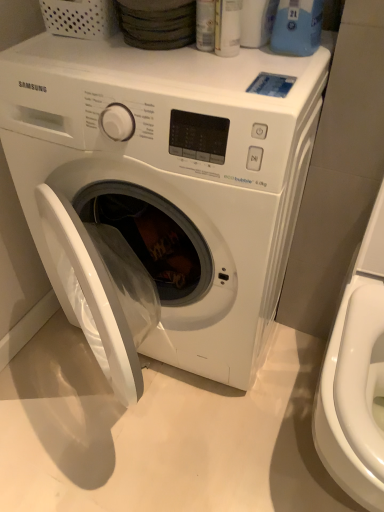
Locate an element on the screen. free space to the left of white glossy washer at right is located at coordinates (249, 444).